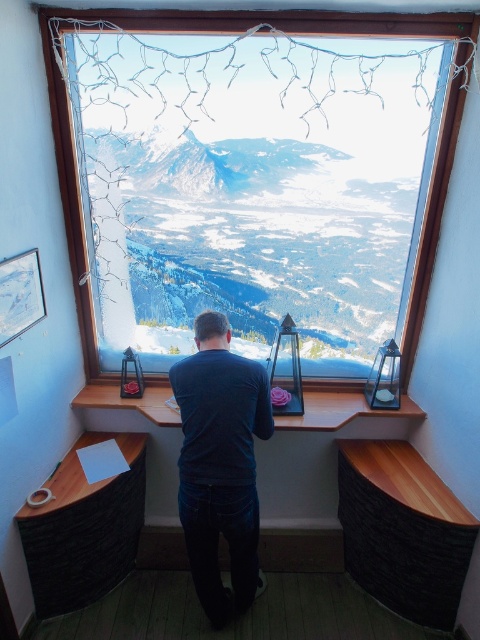
Looking at this image, you are standing in the room and want to touch both the dark blue shirt at center and the transparent glass window at center. Which object will you reach first?

You will reach the dark blue shirt at center first because it is closer to you than the transparent glass window at center.

Based on the photo, you are sitting at the wooden desk at lower left and want to look outside through the transparent glass window at center. Can you see the window from your current position?

The transparent glass window at center is above the wooden desk at lower left, so yes, you can see the window from your current position at the wooden desk at lower left.